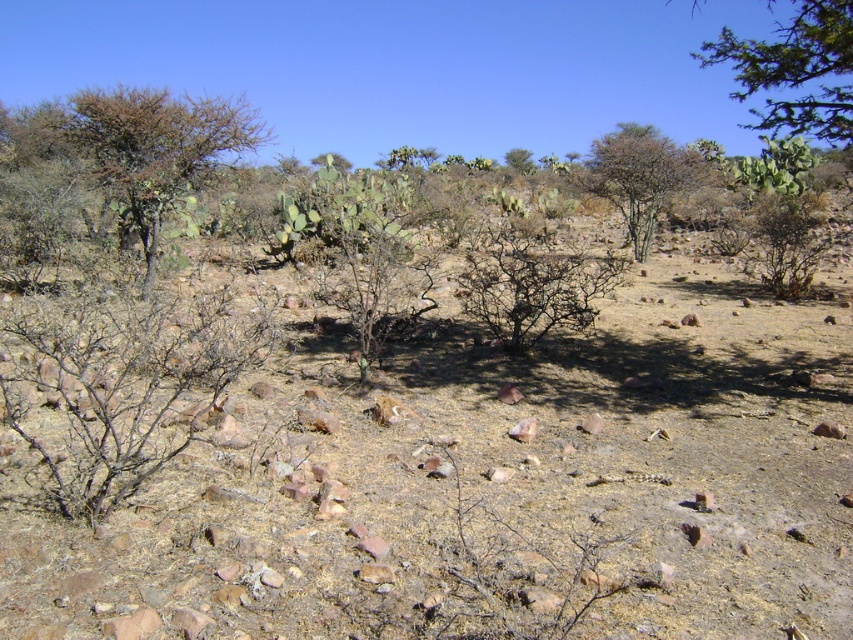
Question: Is brown thorny bush at upper left behind green leafy shrub at center?

Choices:
 (A) no
 (B) yes

Answer: (A)

Question: Can you confirm if dried dirt at center is bigger than brown thorny bush at upper left?

Choices:
 (A) no
 (B) yes

Answer: (A)

Question: Among these objects, which one is farthest from the camera?

Choices:
 (A) brown thorny bush at upper left
 (B) green leafy tree at upper right
 (C) dried dirt at center

Answer: (A)

Question: Is dried dirt at center thinner than green leafy shrub at center?

Choices:
 (A) yes
 (B) no

Answer: (A)

Question: Which point is farther to the camera?

Choices:
 (A) dried dirt at center
 (B) green leafy shrub at center

Answer: (B)

Question: Among these objects, which one is nearest to the camera?

Choices:
 (A) green leafy tree at upper right
 (B) green leafy shrub at center
 (C) dried dirt at center

Answer: (C)